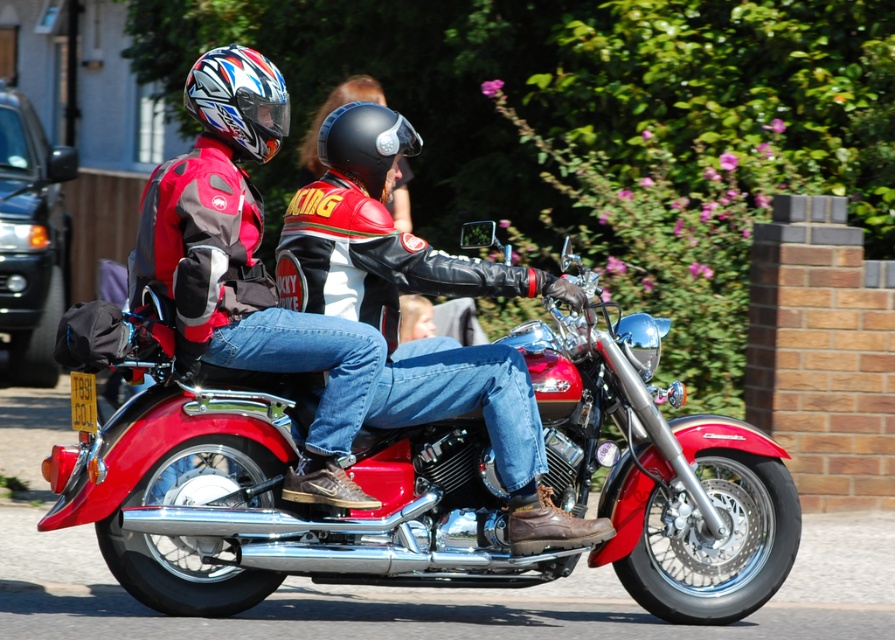
You are a pedestrian standing on the sidewalk observing the scene. You want to take a photo of the shiny chrome motorcycle at center without including the shiny multicolored helmet at upper left in the frame. Is it possible to do so given their positions?

The shiny chrome motorcycle at center is in front of the shiny multicolored helmet at upper left, so yes, you can take a photo of the shiny chrome motorcycle at center without including the shiny multicolored helmet at upper left by positioning yourself so the motorcycle blocks the view of the helmet.

You are a delivery person who needs to carry a package that is 1 meter wide. The package must be placed between the shiny chrome motorcycle at center and the shiny multicolored helmet at upper left. Can you fit the package in that space?

The shiny chrome motorcycle at center might be wider than shiny multicolored helmet at upper left, so it is uncertain if the space between them is wide enough to fit the 1 meter wide package. Further measurement is needed.

You are a delivery person who needs to attach a GPS tracker to the motorcycle. The GPS tracker requires a minimum of 16 inches of space to be securely mounted. Based on the scene, can you determine if there is enough space between the shiny multicolored helmet at upper left and the black matte helmet at center to place the tracker?

The shiny multicolored helmet at upper left and the black matte helmet at center are 15.14 inches apart, which is less than the required 16 inches. Therefore, there is not enough space to securely mount the GPS tracker between them.